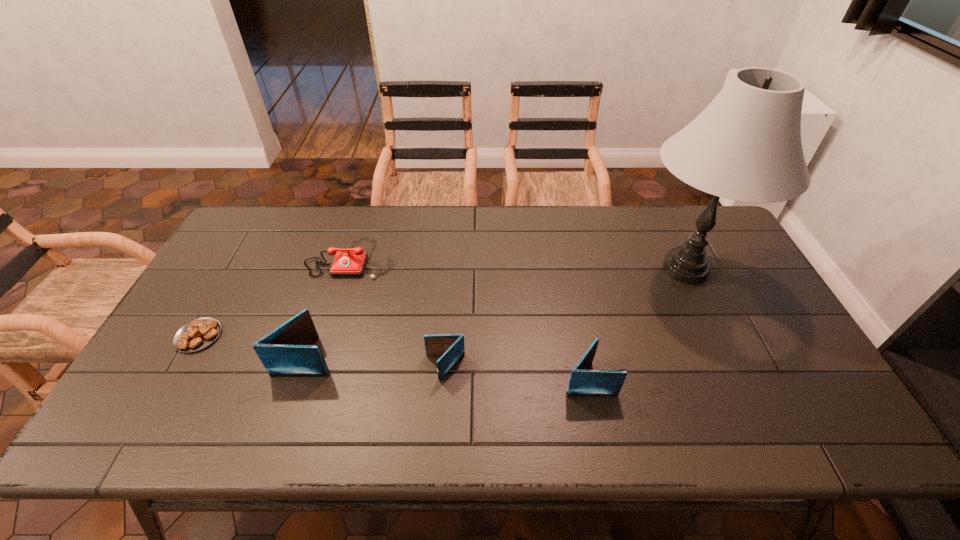
Find the location of a particular element. The height and width of the screenshot is (540, 960). the closest object to the rightmost object is located at coordinates (583, 382).

You are a GUI agent. You are given a task and a screenshot of the screen. Output one action in this format:
    pyautogui.click(x=<x>, y=<y>)
    Task: Click on the object that is the closest to the fifth shortest object
    The image size is (960, 540).
    Given the screenshot: What is the action you would take?
    pyautogui.click(x=199, y=333)

Choose which wallet is the third nearest neighbor to the leftmost object. Please provide its 2D coordinates. Your answer should be formatted as a tuple, i.e. [(x, y)], where the tuple contains the x and y coordinates of a point satisfying the conditions above.

[(583, 382)]

Locate which wallet is the closest to the second tallest wallet. Please provide its 2D coordinates. Your answer should be formatted as a tuple, i.e. [(x, y)], where the tuple contains the x and y coordinates of a point satisfying the conditions above.

[(451, 346)]

Locate an element on the screen. free space in the image that satisfies the following two spatial constraints: 1. on the front side of the lamp; 2. on the exterior surface of the leftmost wallet is located at coordinates (727, 357).